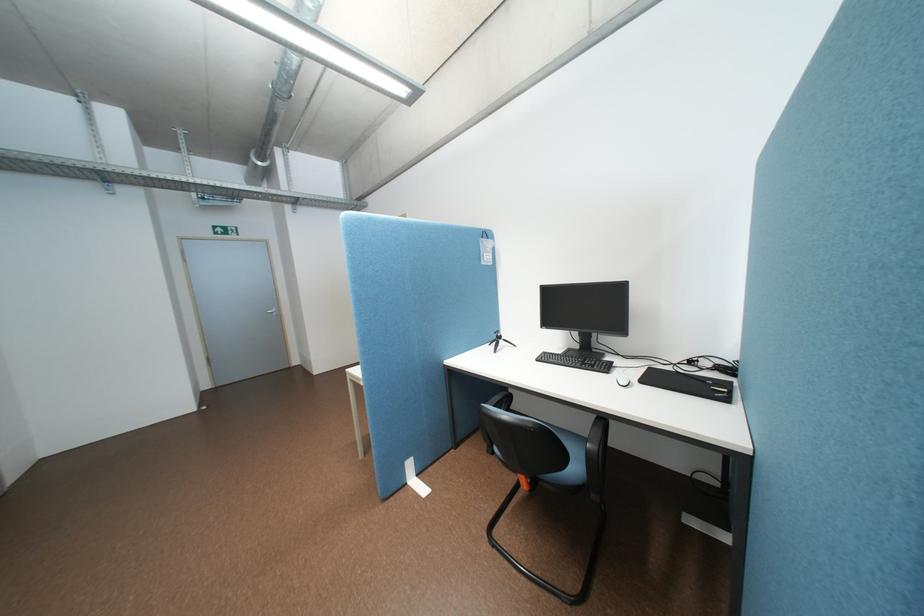
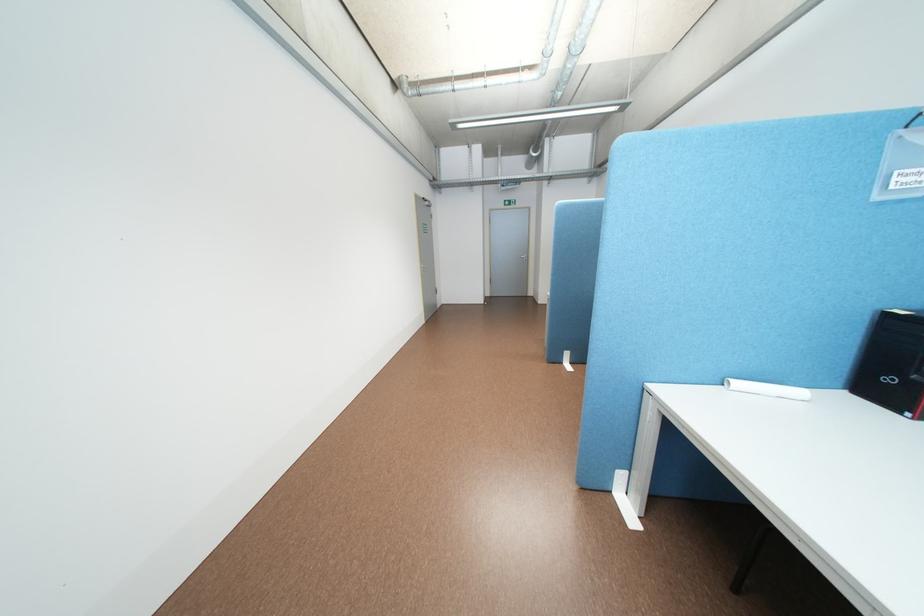
Locate, in the second image, the point that corresponds to the point at 217,386 in the first image.

(499, 294)